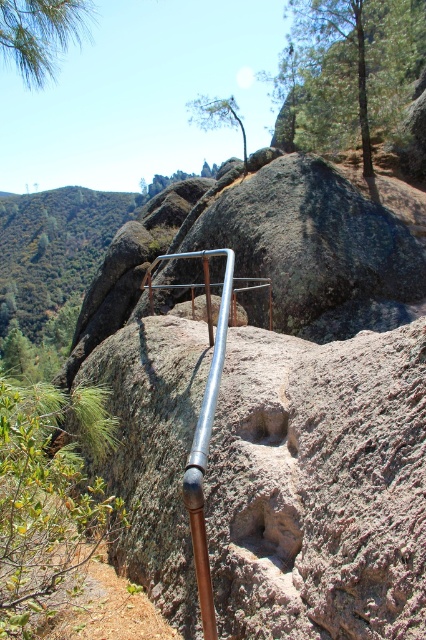
From the picture: Does smooth granite boulder at center have a greater height compared to silver metallic pipe at center?

Indeed, smooth granite boulder at center has a greater height compared to silver metallic pipe at center.

Does smooth granite boulder at center appear on the left side of silver metallic pipe at center?

Indeed, smooth granite boulder at center is positioned on the left side of silver metallic pipe at center.

Measure the distance between smooth granite boulder at center and camera.

The distance of smooth granite boulder at center from camera is 5.31 feet.

What are the coordinates of `smooth granite boulder at center` in the screenshot? It's located at (317, 412).